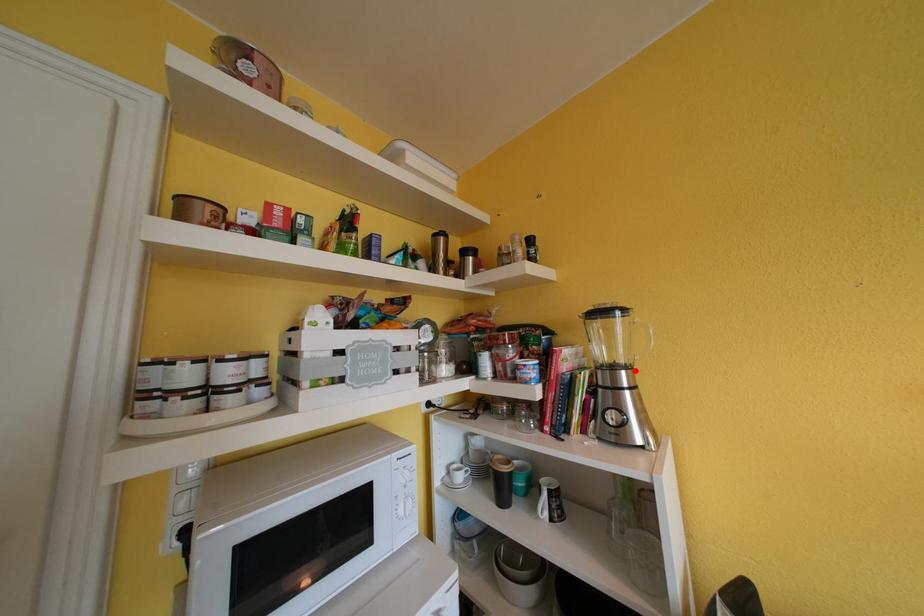
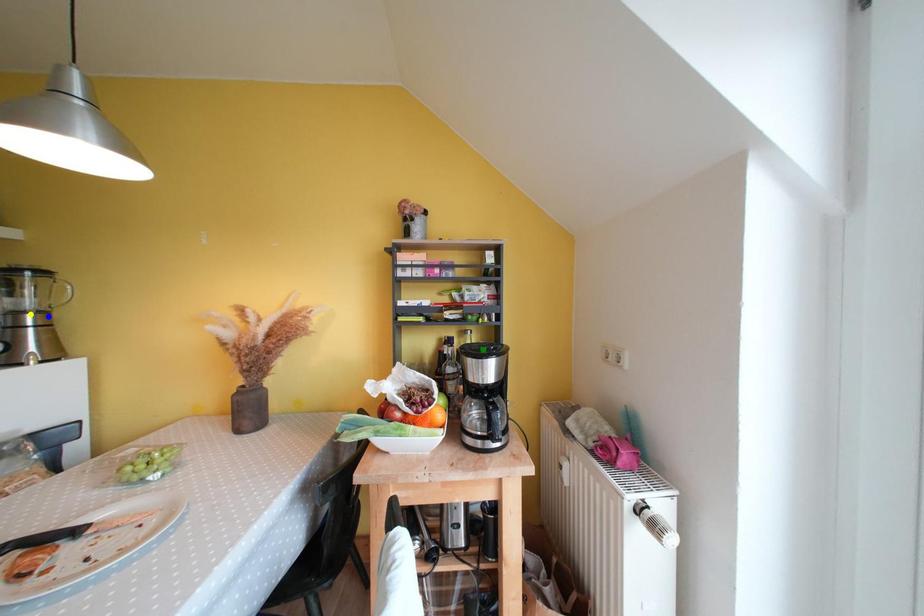
Question: I am providing you with two images of the same scene from different viewpoints. A red point is marked on the first image. You are given multiple points on the second image. Which point in image 2 is actually the same real-world point as the red point in image 1?

Choices:
 (A) yellow point
 (B) blue point
 (C) green point

Answer: (B)